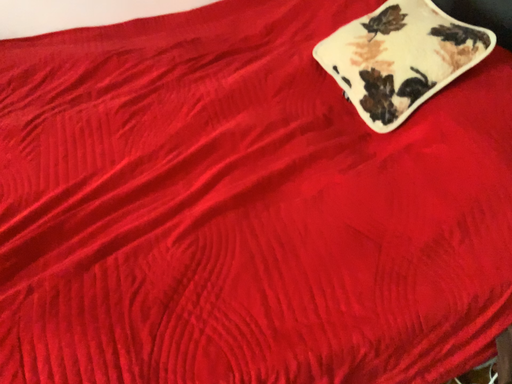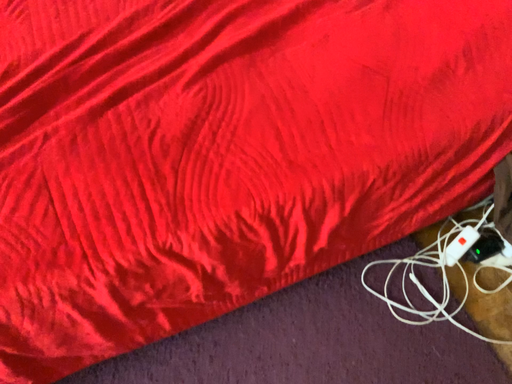
Question: Which way did the camera rotate in the video?

Choices:
 (A) rotated upward
 (B) rotated downward

Answer: (B)